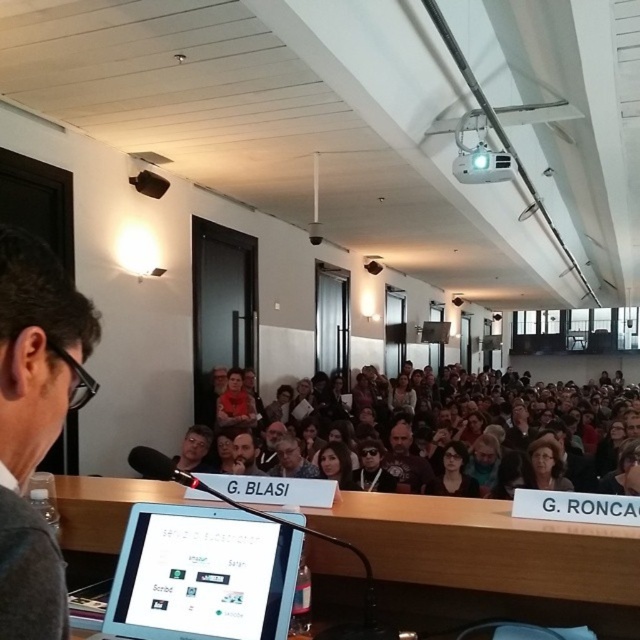
Question: Considering the real-world distances, which object is closest to the dark brown leather jacket at center?

Choices:
 (A) black matte glasses at left
 (B) blue scarf at center

Answer: (B)

Question: Which of the following is the farthest from the observer?

Choices:
 (A) dark brown leather jacket at center
 (B) silver metallic tablet at center

Answer: (A)

Question: Can you confirm if blue scarf at center is positioned below matte black hair at center?

Choices:
 (A) no
 (B) yes

Answer: (A)

Question: Can you confirm if black matte glasses at left is bigger than silver metallic tablet at center?

Choices:
 (A) yes
 (B) no

Answer: (B)

Question: Is black matte glasses at left positioned before matte black hair at center?

Choices:
 (A) no
 (B) yes

Answer: (B)

Question: Which of the following is the farthest from the observer?

Choices:
 (A) matte black glasses at center
 (B) blue scarf at center
 (C) dark brown hair at center

Answer: (B)